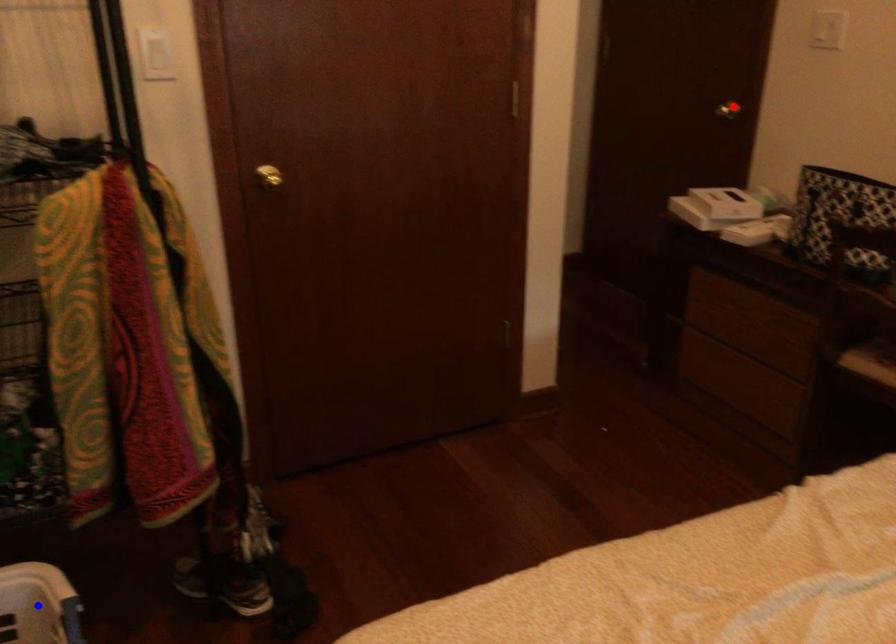
Question: Which of the two points in the image is closer to the camera?

Choices:
 (A) Blue point is closer.
 (B) Red point is closer.

Answer: (A)